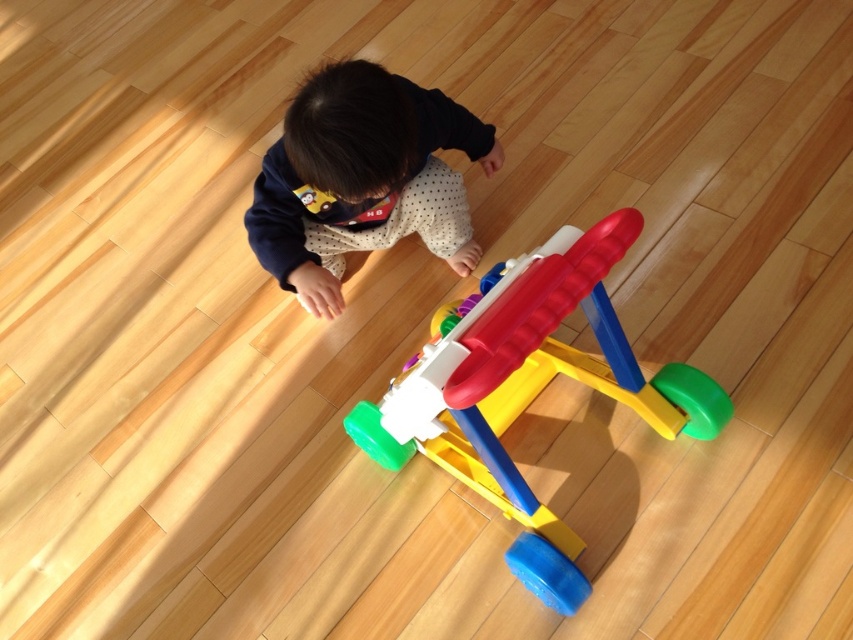
Question: Among these objects, which one is farthest from the camera?

Choices:
 (A) black matte shirt at upper center
 (B) plastic walker at center

Answer: (A)

Question: Is plastic walker at center bigger than black matte shirt at upper center?

Choices:
 (A) no
 (B) yes

Answer: (B)

Question: Is plastic walker at center wider than black matte shirt at upper center?

Choices:
 (A) no
 (B) yes

Answer: (B)

Question: Does plastic walker at center have a smaller size compared to black matte shirt at upper center?

Choices:
 (A) yes
 (B) no

Answer: (B)

Question: Which point is closer to the camera?

Choices:
 (A) (399, 234)
 (B) (523, 532)

Answer: (B)